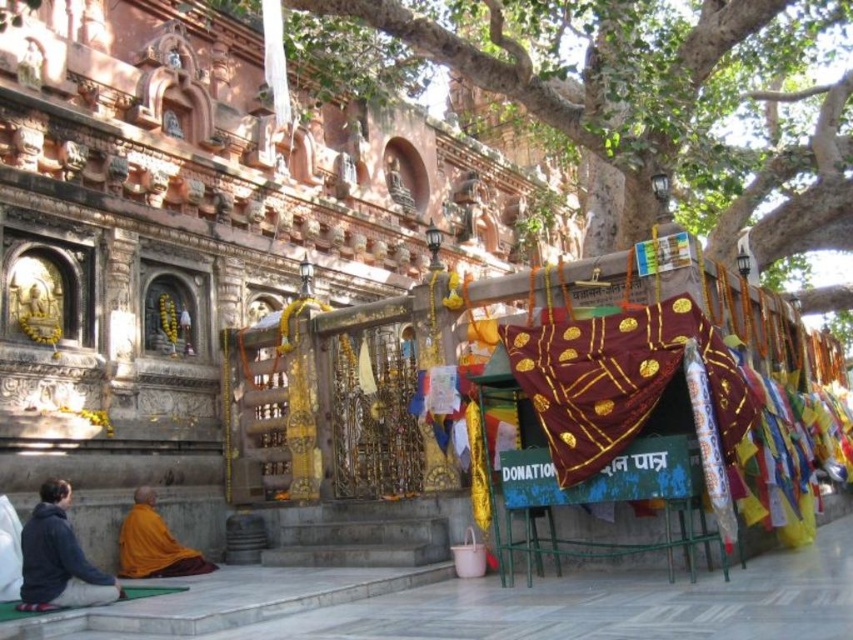
Locate an element on the screen. dark blue hoodie at lower left is located at coordinates (57, 557).

Which is behind, point (408, 36) or point (41, 522)?

The point (408, 36) is behind.

Is point (828, 182) positioned in front of point (36, 561)?

No, it is behind (36, 561).

Where is `green leafy tree at upper center`? The image size is (853, 640). green leafy tree at upper center is located at coordinates (624, 92).

Who is shorter, green leafy tree at upper center or orange cloth monk at lower left?

orange cloth monk at lower left is shorter.

Does green leafy tree at upper center appear on the left side of orange cloth monk at lower left?

In fact, green leafy tree at upper center is to the right of orange cloth monk at lower left.

Is point (721, 12) farther from camera compared to point (132, 545)?

Yes.

Identify the location of green leafy tree at upper center. This screenshot has height=640, width=853. (624, 92).